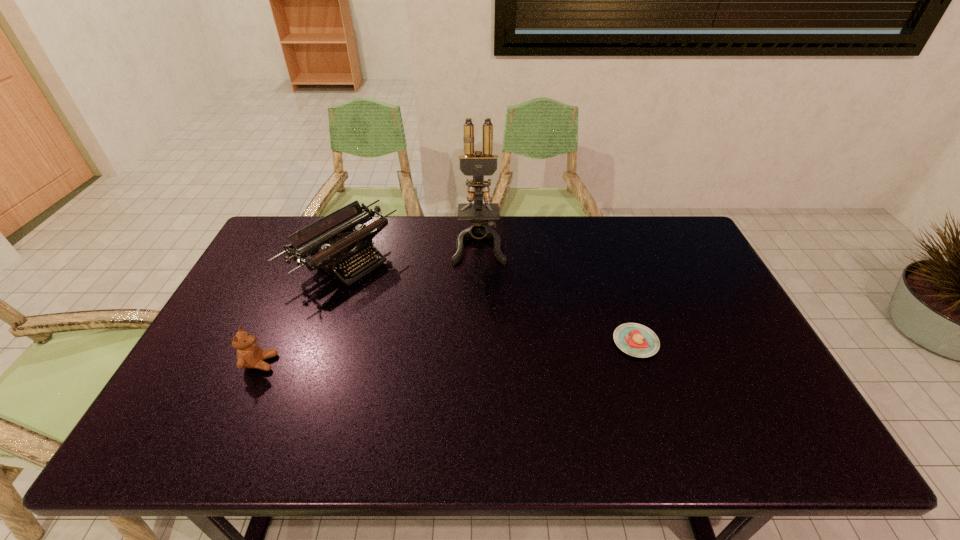
This screenshot has width=960, height=540. What are the coordinates of `free region at the near edge of the desktop` in the screenshot? It's located at (304, 388).

In the image, there is a desktop. At what (x,y) coordinates should I click in order to perform the action: click on free space at the left edge. Please return your answer as a coordinate pair (x, y). Looking at the image, I should click on (240, 302).

In the image, there is a desktop. What are the coordinates of `vacant space at the right edge` in the screenshot? It's located at (693, 278).

Locate an element on the screen. The height and width of the screenshot is (540, 960). free space at the near right corner of the desktop is located at coordinates (744, 396).

In order to click on vacant area that lies between the typewriter and the microscope in this screenshot , I will do `click(412, 251)`.

This screenshot has height=540, width=960. I want to click on free area in between the shortest object and the tallest object, so click(x=558, y=293).

Find the location of a particular element. The width and height of the screenshot is (960, 540). vacant space that's between the teddy bear and the typewriter is located at coordinates (302, 311).

Find the location of a particular element. This screenshot has height=540, width=960. free space between the tallest object and the rightmost object is located at coordinates 558,293.

Find the location of `free space that is in between the tallest object and the shortest object`. free space that is in between the tallest object and the shortest object is located at coordinates (558, 293).

Find the location of a particular element. The width and height of the screenshot is (960, 540). free area in between the second tallest object and the microscope is located at coordinates (412, 251).